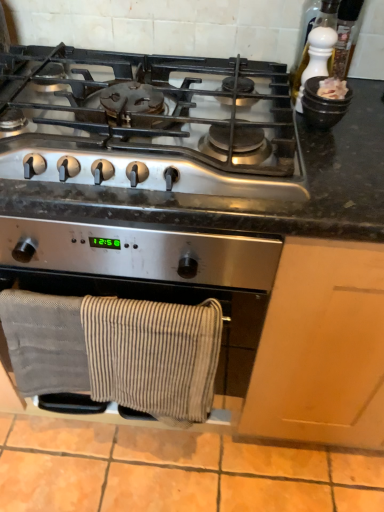
Question: Can you confirm if satin silver gas stove at upper center is taller than gray cotton towels at lower center?

Choices:
 (A) yes
 (B) no

Answer: (B)

Question: Is satin silver gas stove at upper center outside gray cotton towels at lower center?

Choices:
 (A) yes
 (B) no

Answer: (A)

Question: From a real-world perspective, is satin silver gas stove at upper center positioned over gray cotton towels at lower center based on gravity?

Choices:
 (A) yes
 (B) no

Answer: (A)

Question: From the image's perspective, is satin silver gas stove at upper center located above gray cotton towels at lower center?

Choices:
 (A) no
 (B) yes

Answer: (B)

Question: Can you confirm if satin silver gas stove at upper center is smaller than gray cotton towels at lower center?

Choices:
 (A) no
 (B) yes

Answer: (A)

Question: Considering the positions of satin silver gas stove at upper center and white ceramic pepper grinder at upper right in the image, is satin silver gas stove at upper center wider or thinner than white ceramic pepper grinder at upper right?

Choices:
 (A) thin
 (B) wide

Answer: (B)

Question: Would you say satin silver gas stove at upper center is to the left or to the right of white ceramic pepper grinder at upper right in the picture?

Choices:
 (A) left
 (B) right

Answer: (A)

Question: From their relative heights in the image, would you say satin silver gas stove at upper center is taller or shorter than white ceramic pepper grinder at upper right?

Choices:
 (A) short
 (B) tall

Answer: (A)

Question: From the image's perspective, relative to white ceramic pepper grinder at upper right, is satin silver gas stove at upper center above or below?

Choices:
 (A) below
 (B) above

Answer: (A)

Question: From a real-world perspective, is gray cotton towels at lower center physically located above or below satin silver gas stove at upper center?

Choices:
 (A) below
 (B) above

Answer: (A)

Question: Based on their sizes in the image, would you say gray cotton towels at lower center is bigger or smaller than satin silver gas stove at upper center?

Choices:
 (A) small
 (B) big

Answer: (A)

Question: Is point (129, 232) closer or farther from the camera than point (238, 159)?

Choices:
 (A) closer
 (B) farther

Answer: (A)

Question: From the image's perspective, is gray cotton towels at lower center above or below satin silver gas stove at upper center?

Choices:
 (A) above
 (B) below

Answer: (B)

Question: In the image, is white ceramic pepper grinder at upper right on the left side or the right side of satin silver gas stove at upper center?

Choices:
 (A) right
 (B) left

Answer: (A)

Question: From the image's perspective, is white ceramic pepper grinder at upper right above or below satin silver gas stove at upper center?

Choices:
 (A) above
 (B) below

Answer: (A)